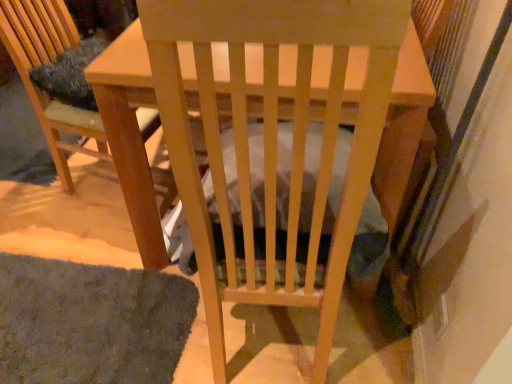
Question: Does green shaggy mat at lower left have a lesser height compared to wooden chair at left?

Choices:
 (A) no
 (B) yes

Answer: (B)

Question: Considering the relative positions of green shaggy mat at lower left and wooden chair at left in the image provided, is green shaggy mat at lower left behind wooden chair at left?

Choices:
 (A) no
 (B) yes

Answer: (A)

Question: Considering the relative sizes of green shaggy mat at lower left and wooden chair at left in the image provided, is green shaggy mat at lower left wider than wooden chair at left?

Choices:
 (A) no
 (B) yes

Answer: (A)

Question: Is green shaggy mat at lower left bigger than wooden chair at left?

Choices:
 (A) no
 (B) yes

Answer: (A)

Question: Is green shaggy mat at lower left at the right side of wooden chair at left?

Choices:
 (A) yes
 (B) no

Answer: (B)

Question: Is green shaggy mat at lower left positioned beyond the bounds of wooden chair at left?

Choices:
 (A) no
 (B) yes

Answer: (B)

Question: Does green shaggy mat at lower left have a lesser width compared to wooden table at center?

Choices:
 (A) yes
 (B) no

Answer: (A)

Question: Is green shaggy mat at lower left behind wooden table at center?

Choices:
 (A) no
 (B) yes

Answer: (B)

Question: Is green shaggy mat at lower left outside wooden table at center?

Choices:
 (A) yes
 (B) no

Answer: (A)

Question: Is green shaggy mat at lower left far away from wooden table at center?

Choices:
 (A) no
 (B) yes

Answer: (A)

Question: Considering the relative sizes of green shaggy mat at lower left and wooden table at center in the image provided, is green shaggy mat at lower left wider than wooden table at center?

Choices:
 (A) yes
 (B) no

Answer: (B)

Question: From a real-world perspective, is green shaggy mat at lower left on wooden table at center?

Choices:
 (A) yes
 (B) no

Answer: (B)

Question: Can you confirm if wooden table at center is shorter than green shaggy mat at lower left?

Choices:
 (A) yes
 (B) no

Answer: (B)